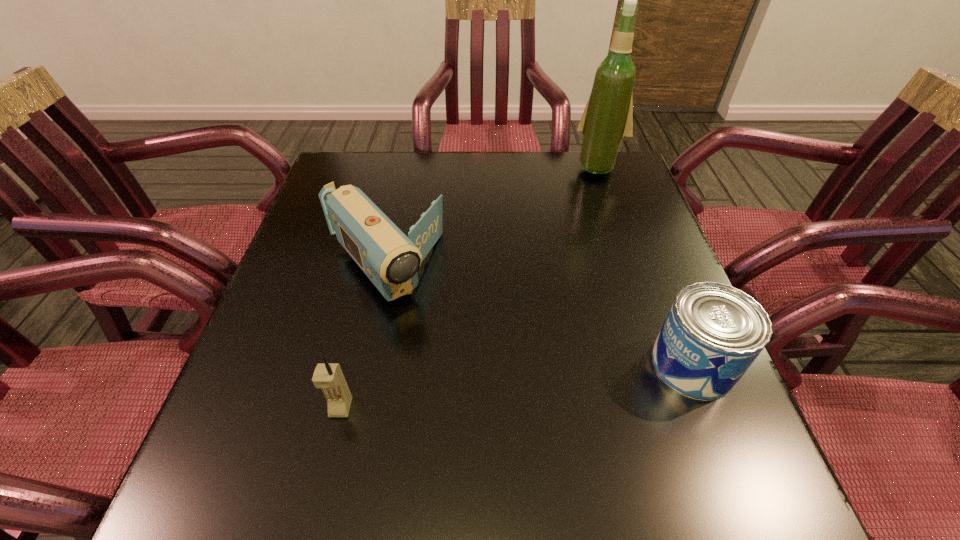
Identify the location of cellular telephone. The width and height of the screenshot is (960, 540). (329, 377).

I want to click on can, so click(x=713, y=332).

Where is `the tallest object`? This screenshot has height=540, width=960. the tallest object is located at coordinates point(607,121).

What are the coordinates of `wine bottle` in the screenshot? It's located at (607, 121).

At what (x,y) coordinates should I click in order to perform the action: click on camcorder. Please return your answer as a coordinate pair (x, y). The width and height of the screenshot is (960, 540). Looking at the image, I should click on click(390, 259).

At what (x,y) coordinates should I click in order to perform the action: click on free space located 0.330m on the front label of the shortest object. Please return your answer as a coordinate pair (x, y). The image size is (960, 540). Looking at the image, I should click on (478, 364).

Where is `vacant space located 0.150m on the front label of the shortest object`? Image resolution: width=960 pixels, height=540 pixels. vacant space located 0.150m on the front label of the shortest object is located at coordinates (573, 364).

Where is `vacant space positioned 0.160m on the front label of the shortest object`? The image size is (960, 540). vacant space positioned 0.160m on the front label of the shortest object is located at coordinates (568, 364).

Image resolution: width=960 pixels, height=540 pixels. Find the location of `blank space located 0.280m on the front-facing side of the wine bottle`. blank space located 0.280m on the front-facing side of the wine bottle is located at coordinates (566, 238).

The width and height of the screenshot is (960, 540). Identify the location of free spot located 0.330m on the front-facing side of the wine bottle. (561, 250).